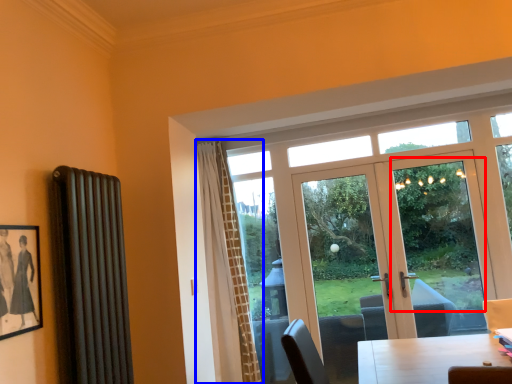
Question: Among these objects, which one is farthest to the camera, window screen (highlighted by a red box) or curtain (highlighted by a blue box)?

Choices:
 (A) window screen
 (B) curtain

Answer: (A)